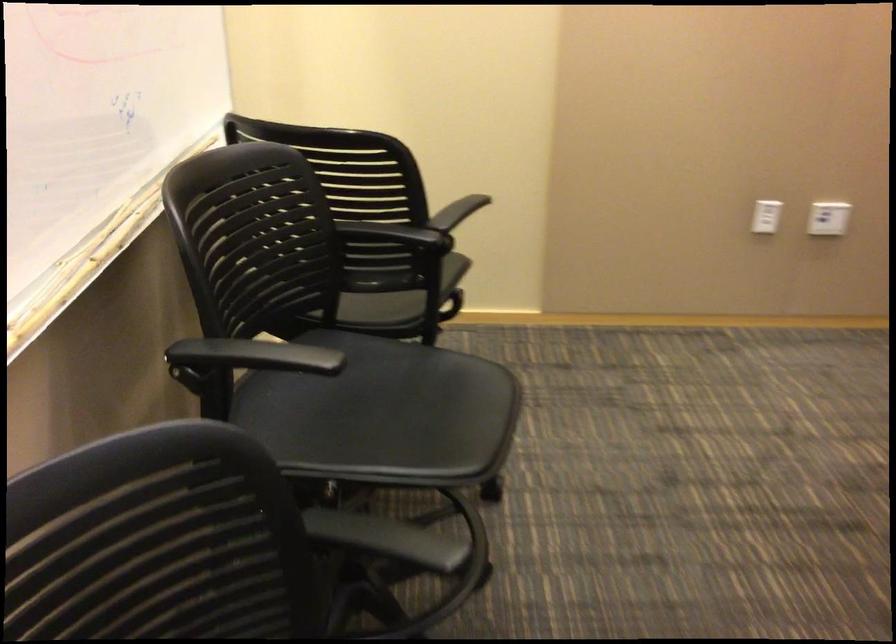
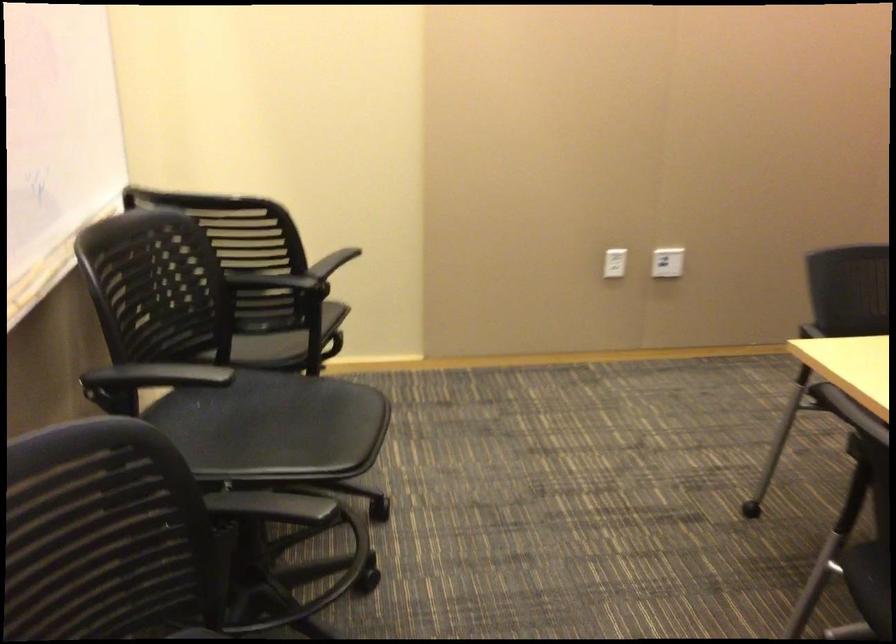
Question: Based on the continuous images, in which direction is the camera rotating? Reply with the corresponding letter.

Choices:
 (A) Left
 (B) Right
 (C) Up
 (D) Down

Answer: (B)